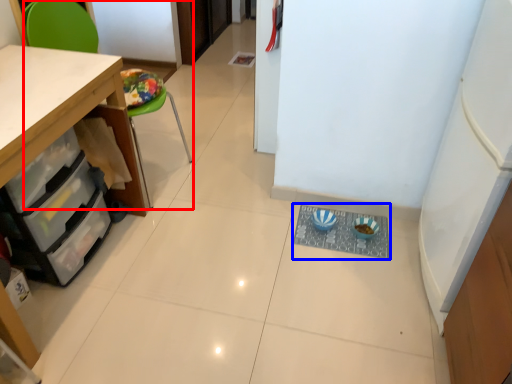
Question: Which object is closer to the camera taking this photo, chair (highlighted by a red box) or wide (highlighted by a blue box)?

Choices:
 (A) chair
 (B) wide

Answer: (A)